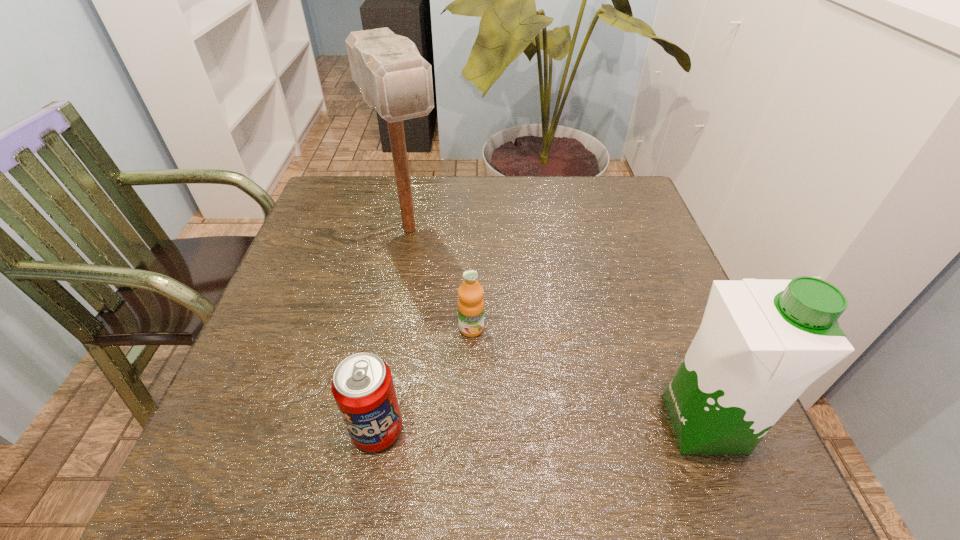
Where is `soda can`? soda can is located at coordinates (362, 385).

Where is `the rightmost object`? The height and width of the screenshot is (540, 960). the rightmost object is located at coordinates (761, 343).

Where is `the third shortest object`? Image resolution: width=960 pixels, height=540 pixels. the third shortest object is located at coordinates tap(761, 343).

The height and width of the screenshot is (540, 960). What are the coordinates of `mallet` in the screenshot? It's located at (394, 79).

Locate an element on the screen. This screenshot has width=960, height=540. the farthest object is located at coordinates (394, 79).

In order to click on the second object from right to left in this screenshot , I will do `click(470, 293)`.

Where is `the third nearest object`? This screenshot has width=960, height=540. the third nearest object is located at coordinates (470, 293).

The width and height of the screenshot is (960, 540). In order to click on vacant area situated 0.360m on the right of the soda can in this screenshot , I will do `click(614, 430)`.

You are a GUI agent. You are given a task and a screenshot of the screen. Output one action in this format:
    pyautogui.click(x=<x>, y=<y>)
    Task: Click on the free space located above the head of the tallest object
    This screenshot has height=540, width=960.
    Given the screenshot: What is the action you would take?
    pyautogui.click(x=442, y=291)

Identify the location of free space located above the head of the tallest object. (484, 362).